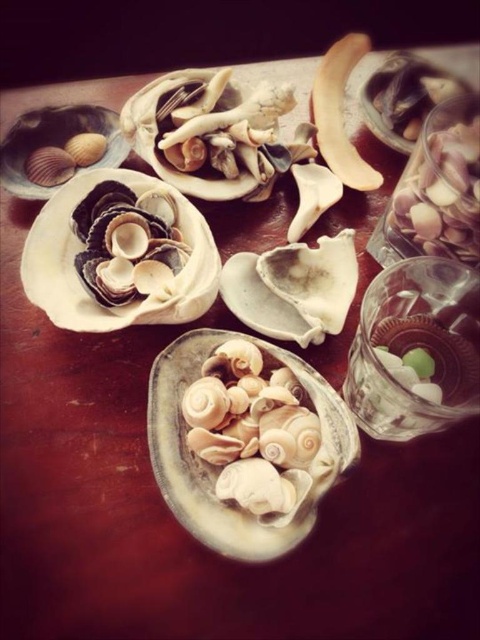
Question: Among these points, which one is nearest to the camera?

Choices:
 (A) (118, 154)
 (B) (386, 125)
 (C) (323, 440)

Answer: (C)

Question: Can you confirm if matte white seashells at center is wider than matte white shell at upper left?

Choices:
 (A) no
 (B) yes

Answer: (B)

Question: Among these points, which one is farthest from the camera?

Choices:
 (A) (162, 365)
 (B) (386, 140)

Answer: (B)

Question: Where is matte white seashell at upper right located in relation to matte white shell at upper left in the image?

Choices:
 (A) above
 (B) below

Answer: (A)

Question: Does matte white seashell at upper right appear under matte white shell at upper left?

Choices:
 (A) yes
 (B) no

Answer: (B)

Question: Which point is farther to the camera?

Choices:
 (A) matte white seashell at upper right
 (B) matte white seashells at center

Answer: (A)